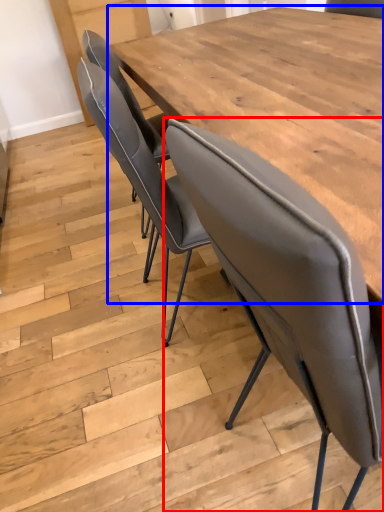
Question: Which point is further to the camera, chair (highlighted by a red box) or table (highlighted by a blue box)?

Choices:
 (A) chair
 (B) table

Answer: (B)